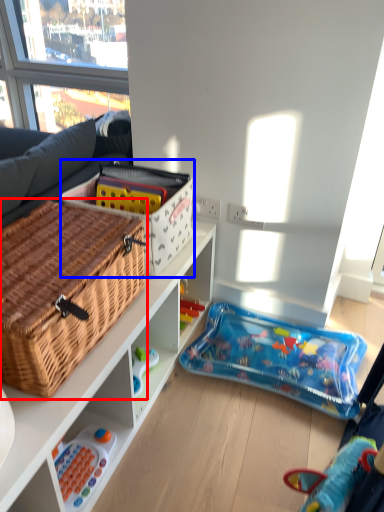
Question: Among these objects, which one is nearest to the camera, picnic basket (highlighted by a red box) or cardboard box (highlighted by a blue box)?

Choices:
 (A) picnic basket
 (B) cardboard box

Answer: (A)